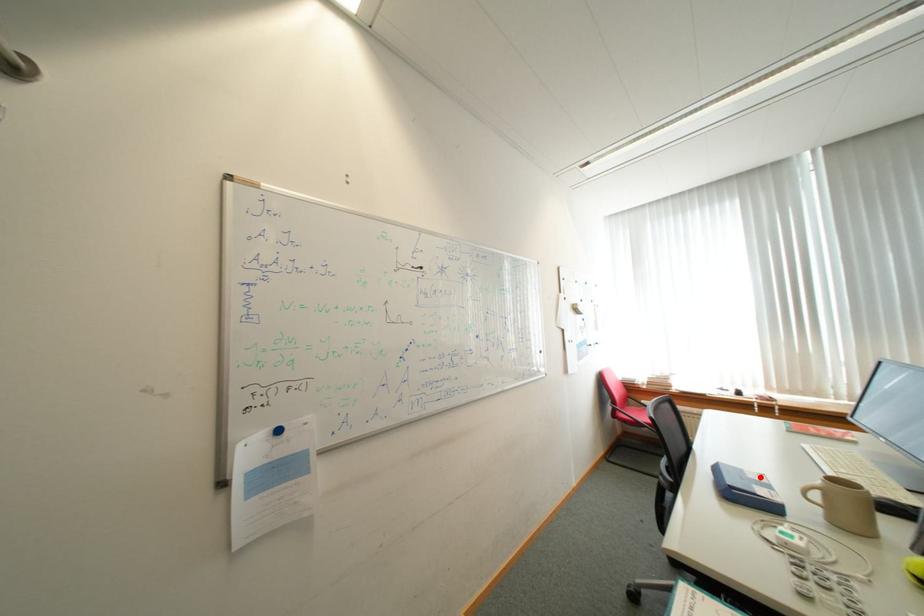
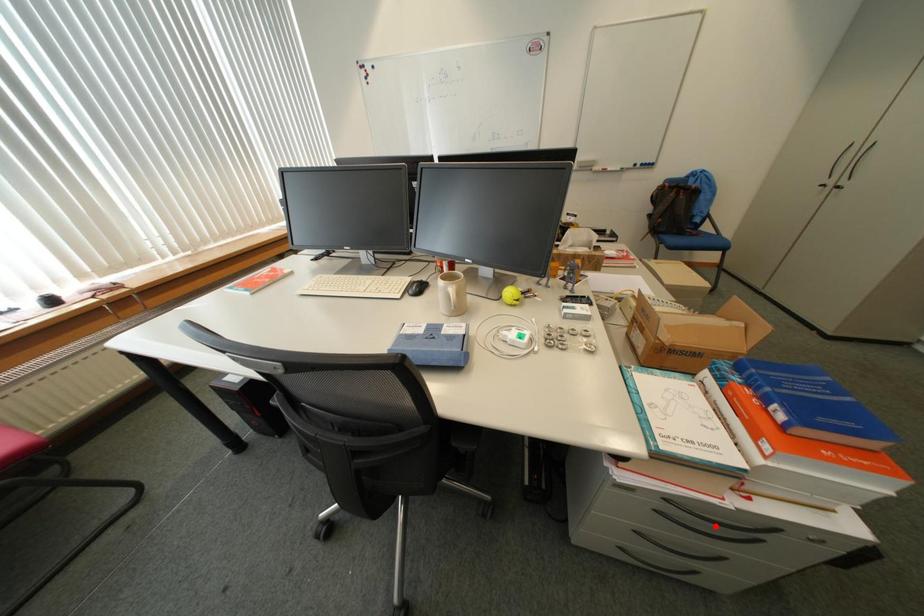
I am providing you with two images of the same scene from different viewpoints. A red point is marked on the first image and another point is marked on the second image. Is the marked point in image1 the same physical position as the marked point in image2?

No